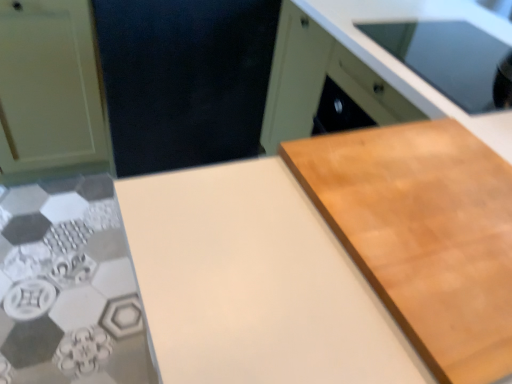
Find the location of a particular element. The image size is (512, 384). free point above white matte countertop at center (from a real-world perspective) is located at coordinates (428, 223).